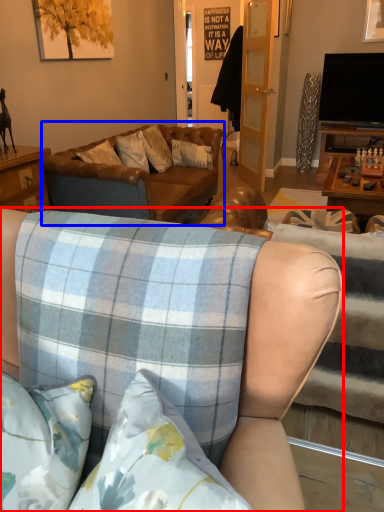
Question: Among these objects, which one is farthest to the camera, studio couch (highlighted by a red box) or studio couch (highlighted by a blue box)?

Choices:
 (A) studio couch
 (B) studio couch

Answer: (B)